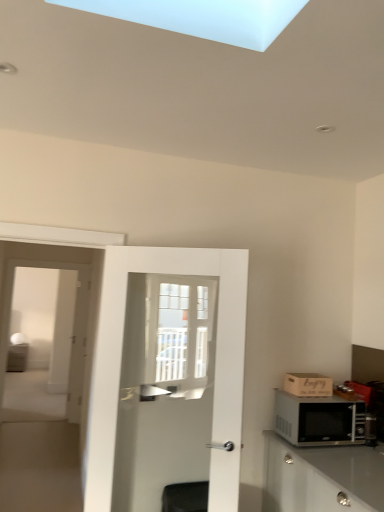
Question: Is black metallic microwave at right thinner than white glass screen door at left?

Choices:
 (A) no
 (B) yes

Answer: (A)

Question: Is black metallic microwave at right closer to the viewer compared to white glass screen door at left?

Choices:
 (A) no
 (B) yes

Answer: (A)

Question: Considering the relative sizes of black metallic microwave at right and white glass screen door at left in the image provided, is black metallic microwave at right bigger than white glass screen door at left?

Choices:
 (A) yes
 (B) no

Answer: (B)

Question: From the image's perspective, would you say black metallic microwave at right is shown under white glass screen door at left?

Choices:
 (A) yes
 (B) no

Answer: (A)

Question: From a real-world perspective, is black metallic microwave at right located beneath white glass screen door at left?

Choices:
 (A) yes
 (B) no

Answer: (A)

Question: Is black metallic microwave at right to the right of white glass screen door at left from the viewer's perspective?

Choices:
 (A) no
 (B) yes

Answer: (B)

Question: From a real-world perspective, is black metallic microwave at right under white glossy door at center?

Choices:
 (A) no
 (B) yes

Answer: (B)

Question: Is black metallic microwave at right wider than white glossy door at center?

Choices:
 (A) no
 (B) yes

Answer: (B)

Question: Is black metallic microwave at right located outside white glossy door at center?

Choices:
 (A) yes
 (B) no

Answer: (A)

Question: Does black metallic microwave at right have a greater height compared to white glossy door at center?

Choices:
 (A) no
 (B) yes

Answer: (A)

Question: Considering the relative sizes of black metallic microwave at right and white glossy door at center in the image provided, is black metallic microwave at right bigger than white glossy door at center?

Choices:
 (A) yes
 (B) no

Answer: (B)

Question: Are black metallic microwave at right and white glossy door at center located far from each other?

Choices:
 (A) no
 (B) yes

Answer: (A)

Question: From a real-world perspective, does wooden crate at right stand above white glass screen door at left?

Choices:
 (A) yes
 (B) no

Answer: (B)